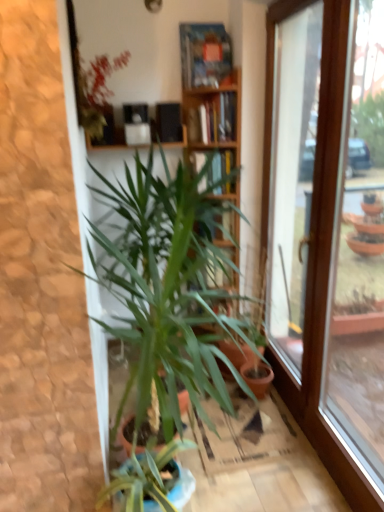
Question: From the image's perspective, is transparent glass window at right positioned above or below wooden bookcase at center?

Choices:
 (A) above
 (B) below

Answer: (B)

Question: Is transparent glass window at right bigger or smaller than wooden bookcase at center?

Choices:
 (A) big
 (B) small

Answer: (A)

Question: Which of these objects is positioned closest to the green leafy plant at center, which is the 1th houseplant in bottom-to-top order?

Choices:
 (A) wooden bookcase at center
 (B) matte black speakers at upper center, which is counted as the first shelf, starting from the left
 (C) transparent glass window at right
 (D) transparent glass window at right
 (E) green leafy plant at upper left, which is the 2th houseplant from bottom to top

Answer: (A)

Question: Which of these objects is positioned closest to the hardcover book at upper center?

Choices:
 (A) green leafy plant at center, arranged as the 2th houseplant when viewed from the top
 (B) green leafy plant at upper left, placed as the 1th houseplant when sorted from top to bottom
 (C) wooden bookshelf at center, placed as the 1th shelf when sorted from right to left
 (D) transparent glass window at right
 (E) wooden bookcase at center

Answer: (E)